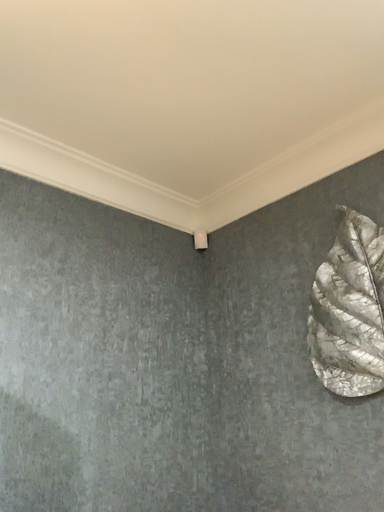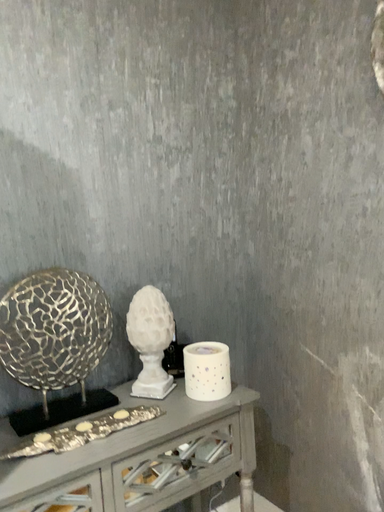
Question: Which way did the camera rotate in the video?

Choices:
 (A) rotated downward
 (B) rotated upward

Answer: (A)